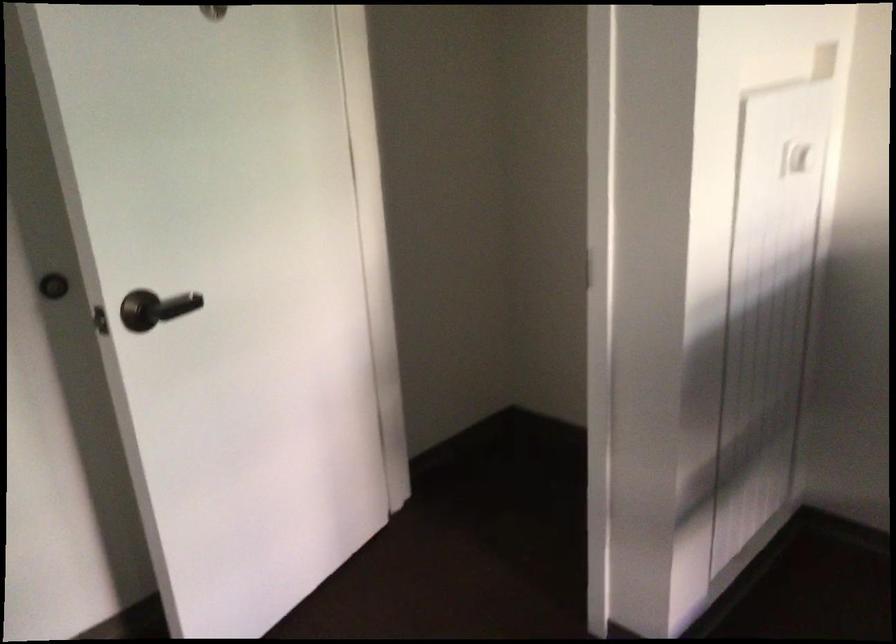
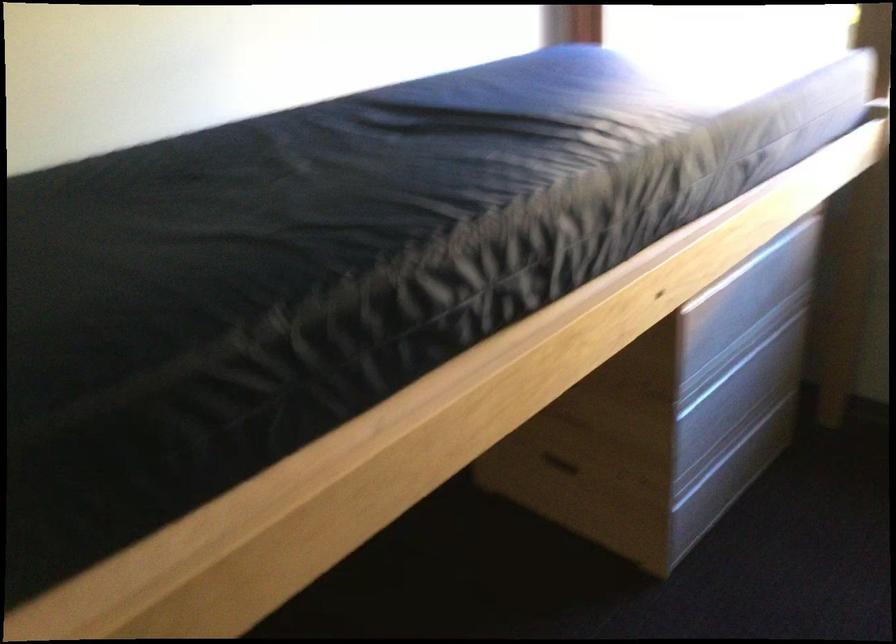
The first image is from the beginning of the video and the second image is from the end. How did the camera likely rotate when shooting the video?

The camera's rotation is toward right-down.